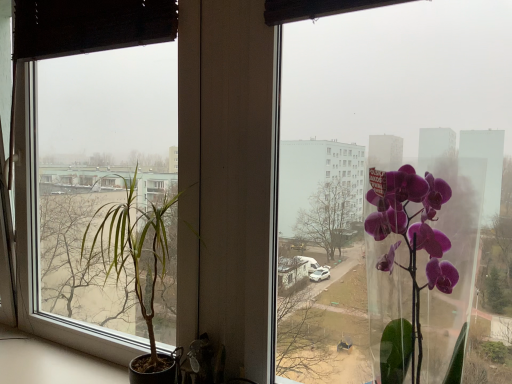
Question: Would you say transparent glass window at center is outside transparent glass vase at right?

Choices:
 (A) no
 (B) yes

Answer: (B)

Question: From the image's perspective, is transparent glass window at center located above transparent glass vase at right?

Choices:
 (A) yes
 (B) no

Answer: (A)

Question: Does transparent glass window at center have a greater width compared to transparent glass vase at right?

Choices:
 (A) no
 (B) yes

Answer: (A)

Question: Is transparent glass window at center bigger than transparent glass vase at right?

Choices:
 (A) no
 (B) yes

Answer: (B)

Question: Is transparent glass window at center thinner than transparent glass vase at right?

Choices:
 (A) no
 (B) yes

Answer: (B)

Question: From their relative heights in the image, would you say transparent glass window at center is taller or shorter than green leafy plant at left?

Choices:
 (A) tall
 (B) short

Answer: (B)

Question: In the image, is transparent glass window at center on the left side or the right side of green leafy plant at left?

Choices:
 (A) left
 (B) right

Answer: (B)

Question: Is transparent glass window at center bigger or smaller than green leafy plant at left?

Choices:
 (A) small
 (B) big

Answer: (A)

Question: In the image, is transparent glass window at center positioned in front of or behind green leafy plant at left?

Choices:
 (A) behind
 (B) front

Answer: (B)

Question: Considering the positions of green leafy plant at left and transparent glass window at center in the image, is green leafy plant at left taller or shorter than transparent glass window at center?

Choices:
 (A) tall
 (B) short

Answer: (A)

Question: Would you say green leafy plant at left is to the left or to the right of transparent glass window at center in the picture?

Choices:
 (A) right
 (B) left

Answer: (B)

Question: From the image's perspective, relative to transparent glass window at center, is green leafy plant at left above or below?

Choices:
 (A) below
 (B) above

Answer: (A)

Question: Looking at their shapes, would you say green leafy plant at left is wider or thinner than transparent glass window at center?

Choices:
 (A) wide
 (B) thin

Answer: (A)

Question: Is green leafy plant at left bigger or smaller than transparent glass vase at right?

Choices:
 (A) small
 (B) big

Answer: (B)

Question: Based on their positions, is green leafy plant at left located to the left or right of transparent glass vase at right?

Choices:
 (A) right
 (B) left

Answer: (B)